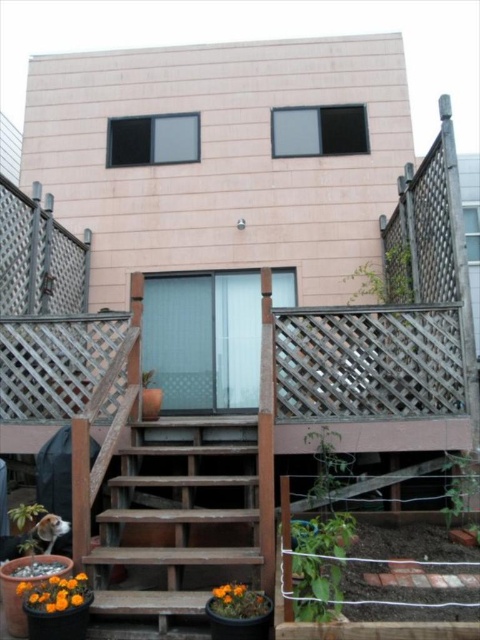
Question: Which is farther from the orange matte flower at lower left?

Choices:
 (A) orange matte flower pot at lower center
 (B) wooden stairs at center
 (C) green leafy plant at center

Answer: (C)

Question: Is green leafy plant at center positioned in front of green leafy plant at lower right?

Choices:
 (A) yes
 (B) no

Answer: (A)

Question: Among these objects, which one is farthest from the camera?

Choices:
 (A) green leafy plant at center
 (B) green matte plant at lower left

Answer: (B)

Question: Which is farther from the wooden stairs at center?

Choices:
 (A) green leafy plant at center
 (B) orange matte flower at lower left
 (C) green matte plant at lower left
 (D) green leafy plant at lower right

Answer: (D)

Question: Does wooden stairs at center have a smaller size compared to green matte plant at lower left?

Choices:
 (A) no
 (B) yes

Answer: (A)

Question: Can you confirm if green leafy plant at center is positioned to the right of green leafy plant at lower right?

Choices:
 (A) yes
 (B) no

Answer: (B)